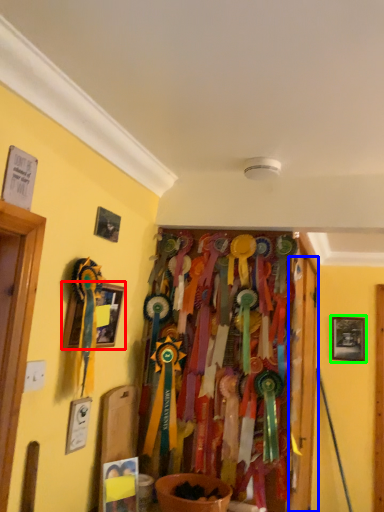
Question: Which object is positioned farthest from picture frame (highlighted by a red box)? Select from door (highlighted by a blue box) and picture frame (highlighted by a green box).

Choices:
 (A) door
 (B) picture frame

Answer: (B)